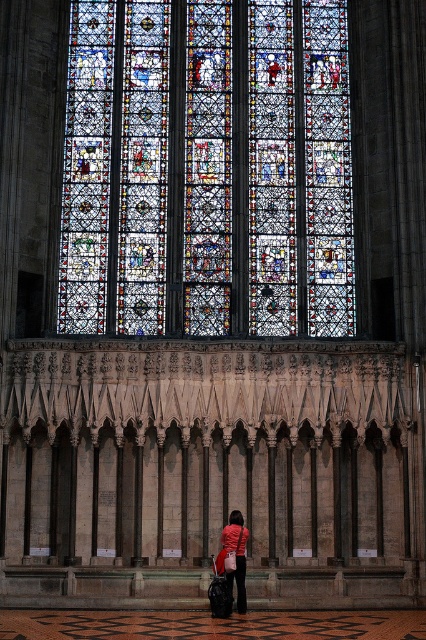
You are an interior designer assessing the cathedral. You notice the multicolored stained glass at center and the matte red jacket at center. Which object takes up more space in the scene?

The multicolored stained glass at center has a larger size compared to the matte red jacket at center, so it takes up more space in the scene.

Consider the image. You are standing in the cathedral and want to take a photo of the multicolored stained glass at center. However, there is a matte red jacket at center in the way. Based on their positions, can you still see the stained glass through the jacket?

The matte red jacket at center is behind the multicolored stained glass at center, so yes, you can still see the stained glass through the jacket because the stained glass is in front of the jacket.

You are standing in the cathedral and notice the multicolored stained glass at center and the matte red jacket at center. Which object is taller?

The multicolored stained glass at center is taller than the matte red jacket at center according to the description.